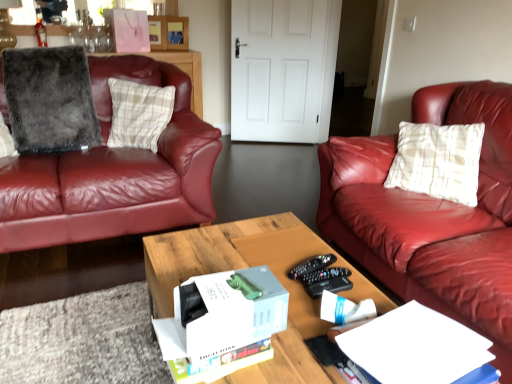
What is the approximate height of gray fluffy pillow at left, the 2th pillow positioned from the right?

gray fluffy pillow at left, the 2th pillow positioned from the right, is 23.12 inches tall.

Where is `plaid fabric pillow at left, the 2th pillow from the left`? The height and width of the screenshot is (384, 512). plaid fabric pillow at left, the 2th pillow from the left is located at coordinates (139, 113).

In order to face wooden coffee table at center, should I rotate leftwards or rightwards?

Rotate your view right by about 1.311°.

At what (x,y) coordinates should I click in order to perform the action: click on gray fluffy pillow at left, which is the first pillow from left to right. Please return your answer as a coordinate pair (x, y). Looking at the image, I should click on (50, 99).

Based on the photo, which object is closer to the camera taking this photo, black plastic remote control at center or wooden coffee table at center?

Positioned in front is wooden coffee table at center.

Which object is thinner, black plastic remote control at center or wooden coffee table at center?

black plastic remote control at center is thinner.

From a real-world perspective, is black plastic remote control at center located beneath wooden coffee table at center?

Actually, black plastic remote control at center is physically above wooden coffee table at center in the real world.

Identify the location of coffee table in front of the black plastic remote control at center. This screenshot has width=512, height=384. (250, 266).

Does black plastic remote control at center have a lesser height compared to translucent glass bottle at upper left?

Yes, black plastic remote control at center is shorter than translucent glass bottle at upper left.

Consider the image. Are black plastic remote control at center and translucent glass bottle at upper left far apart?

black plastic remote control at center is far away from translucent glass bottle at upper left.

Could you tell me if black plastic remote control at center is facing translucent glass bottle at upper left?

No, black plastic remote control at center is not turned towards translucent glass bottle at upper left.

What's the angular difference between black plastic remote control at center and translucent glass bottle at upper left's facing directions?

black plastic remote control at center and translucent glass bottle at upper left are facing 76.4 degrees away from each other.

Does gray fluffy pillow at left, the 2th pillow positioned from the right, appear on the right side of wooden coffee table at center?

Incorrect, gray fluffy pillow at left, the 2th pillow positioned from the right, is not on the right side of wooden coffee table at center.

Could you tell me if gray fluffy pillow at left, the 2th pillow positioned from the right, is turned towards wooden coffee table at center?

Yes, gray fluffy pillow at left, the 2th pillow positioned from the right, is turned towards wooden coffee table at center.

Looking at this image, could wooden coffee table at center be considered to be inside gray fluffy pillow at left, the 2th pillow positioned from the right?

No, wooden coffee table at center is located outside of gray fluffy pillow at left, the 2th pillow positioned from the right.

Does gray fluffy pillow at left, the 2th pillow positioned from the right, have a greater height compared to wooden coffee table at center?

Yes.

From a real-world perspective, which object rests below the other?

wooden coffee table at center.

Which is farther from the camera, (267,244) or (115,139)?

Positioned behind is point (115,139).

Considering the sizes of wooden coffee table at center and plaid fabric pillow at left, the 2th pillow from the left, in the image, is wooden coffee table at center bigger or smaller than plaid fabric pillow at left, the 2th pillow from the left,?

wooden coffee table at center is bigger than plaid fabric pillow at left, the 2th pillow from the left.

Which is correct: wooden coffee table at center is inside plaid fabric pillow at left, the 2th pillow from the left, or outside of it?

wooden coffee table at center exists outside the volume of plaid fabric pillow at left, the 2th pillow from the left.

From a real-world perspective, does wooden coffee table at center sit lower than gray fluffy pillow at left, the 2th pillow positioned from the right?

Yes, from a real-world perspective, wooden coffee table at center is beneath gray fluffy pillow at left, the 2th pillow positioned from the right.

Who is bigger, wooden coffee table at center or gray fluffy pillow at left, the 2th pillow positioned from the right?

With larger size is wooden coffee table at center.

Is wooden coffee table at center next to gray fluffy pillow at left, which is the first pillow from left to right?

wooden coffee table at center and gray fluffy pillow at left, which is the first pillow from left to right, are clearly separated.

Which is less distant, (284, 215) or (73, 133)?

The point (284, 215) is closer to the camera.

Does wooden coffee table at center appear on the right side of white cardboard box at center?

Yes.

Is wooden coffee table at center oriented away from white cardboard box at center?

No, wooden coffee table at center is not facing the opposite direction of white cardboard box at center.

From the image's perspective, is wooden coffee table at center on top of white cardboard box at center?

Incorrect, from the image's perspective, wooden coffee table at center is lower than white cardboard box at center.

Does point (293, 306) come closer to viewer compared to point (215, 360)?

No, it is behind (215, 360).

From the image's perspective, which is below, plaid fabric pillow at left, the first pillow viewed from the right, or translucent glass bottle at upper left?

plaid fabric pillow at left, the first pillow viewed from the right, is shown below in the image.

Find the location of a particular element. The width and height of the screenshot is (512, 384). bottle located behind the plaid fabric pillow at left, the 2th pillow from the left is located at coordinates (40, 29).

Does plaid fabric pillow at left, the first pillow viewed from the right, have a larger size compared to translucent glass bottle at upper left?

Correct, plaid fabric pillow at left, the first pillow viewed from the right, is larger in size than translucent glass bottle at upper left.

Between point (116, 84) and point (45, 28), which one is positioned behind?

The point (45, 28) is farther.

Identify the location of remote control above the wooden coffee table at center (from a real-world perspective). [311, 265].

At what (x,y) coordinates should I click in order to perform the action: click on bottle lying behind the black plastic remote control at center. Please return your answer as a coordinate pair (x, y). The height and width of the screenshot is (384, 512). Looking at the image, I should click on (40, 29).

Based on their spatial positions, is translucent glass bottle at upper left or white paper at lower right further from wooden coffee table at center?

Among the two, translucent glass bottle at upper left is located further to wooden coffee table at center.

Consider the image. Looking at the image, which one is located further to wooden coffee table at center, translucent glass bottle at upper left or black plastic remote control at center?

translucent glass bottle at upper left is further to wooden coffee table at center.

When comparing their distances from wooden coffee table at center, does plaid fabric pillow at left, the 2th pillow from the left, or white paper at lower right seem closer?

white paper at lower right is positioned closer to the anchor wooden coffee table at center.

Which object lies further to the anchor point white paper at lower right, wooden coffee table at center or black plastic remote control at center?

Among the two, black plastic remote control at center is located further to white paper at lower right.

Estimate the real-world distances between objects in this image. Which object is further from gray fluffy pillow at left, the 2th pillow positioned from the right, translucent glass bottle at upper left or white cardboard box at center?

white cardboard box at center lies further to gray fluffy pillow at left, the 2th pillow positioned from the right, than the other object.

From the image, which object appears to be nearer to plaid fabric pillow at left, the 2th pillow from the left, white cardboard box at center or black plastic remote control at center?

black plastic remote control at center.

Which object lies further to the anchor point gray fluffy pillow at left, which is the first pillow from left to right, plaid fabric pillow at left, the first pillow viewed from the right, or translucent glass bottle at upper left?

translucent glass bottle at upper left is further to gray fluffy pillow at left, which is the first pillow from left to right.

Estimate the real-world distances between objects in this image. Which object is further from white cardboard box at center, black plastic remote control at center or white paper at lower right?

black plastic remote control at center is positioned further to the anchor white cardboard box at center.

Where is `coffee table between white cardboard box at center and translucent glass bottle at upper left from front to back`? coffee table between white cardboard box at center and translucent glass bottle at upper left from front to back is located at coordinates (250, 266).

The image size is (512, 384). I want to click on remote control between gray fluffy pillow at left, the 2th pillow positioned from the right, and white paper at lower right from left to right, so click(311, 265).

Find the location of a particular element. This screenshot has width=512, height=384. remote control positioned between white paper at lower right and plaid fabric pillow at left, the 2th pillow from the left, from near to far is located at coordinates pyautogui.click(x=311, y=265).

Image resolution: width=512 pixels, height=384 pixels. What are the coordinates of `remote control located between wooden coffee table at center and plaid fabric pillow at left, the first pillow viewed from the right, in the depth direction` in the screenshot? It's located at 311,265.